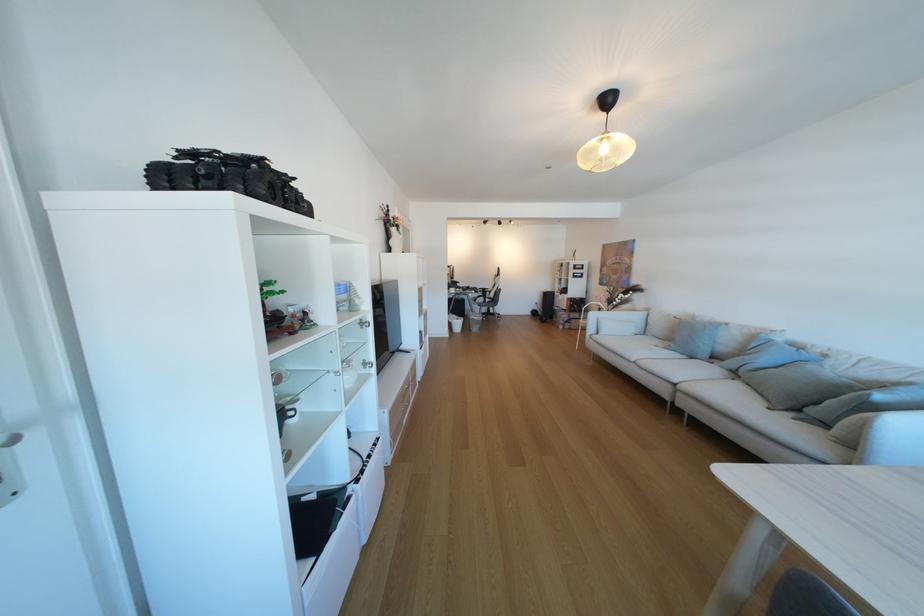
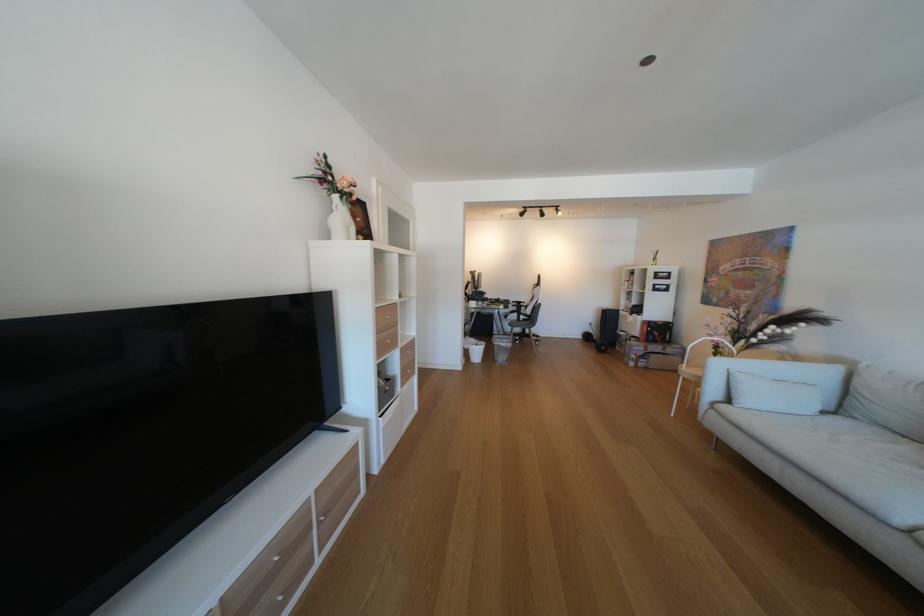
Question: What movement of the cameraman would produce the second image?

Choices:
 (A) Left
 (B) Right
 (C) Forward
 (D) Backward

Answer: (C)